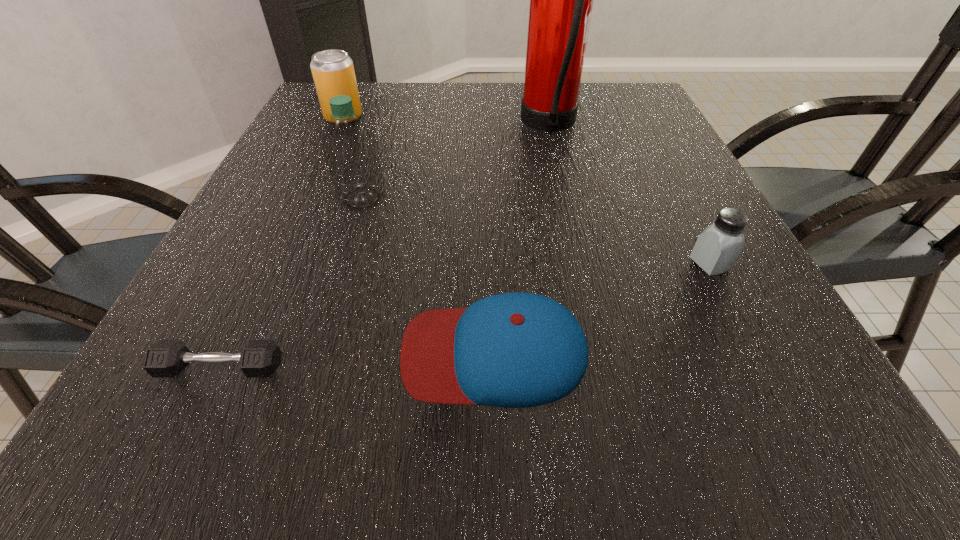
Identify the location of fire extinguisher. (561, 0).

Find the location of a particular element. The image size is (960, 540). the fourth nearest object is located at coordinates (351, 151).

Find the location of `water bottle`. water bottle is located at coordinates (351, 151).

Find the location of a particular element. pop (soda) is located at coordinates (333, 72).

This screenshot has height=540, width=960. What are the coordinates of `the rightmost object` in the screenshot? It's located at (717, 248).

This screenshot has height=540, width=960. Identify the location of the fourth tallest object. (717, 248).

At what (x,y) coordinates should I click in order to perform the action: click on the fifth tallest object. Please return your answer as a coordinate pair (x, y). Image resolution: width=960 pixels, height=540 pixels. Looking at the image, I should click on (515, 350).

Locate an element on the screen. Image resolution: width=960 pixels, height=540 pixels. the shortest object is located at coordinates (166, 358).

Locate an element on the screen. This screenshot has height=540, width=960. free space located on the left of the tallest object is located at coordinates (468, 126).

Find the location of a particular element. Image resolution: width=960 pixels, height=540 pixels. vacant area located on the right of the fourth nearest object is located at coordinates (452, 198).